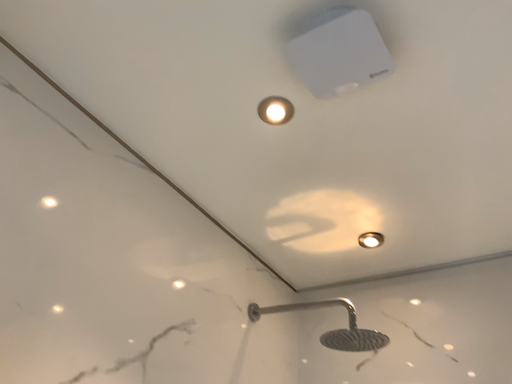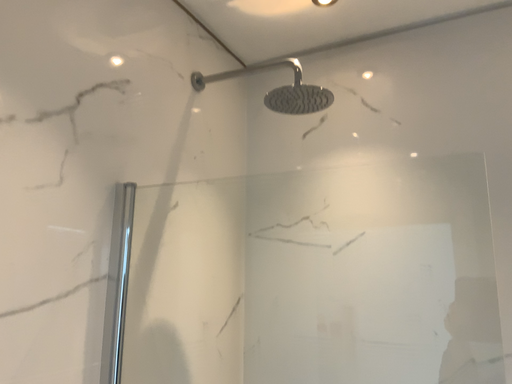
Question: Which way did the camera rotate in the video?

Choices:
 (A) rotated upward
 (B) rotated downward

Answer: (B)